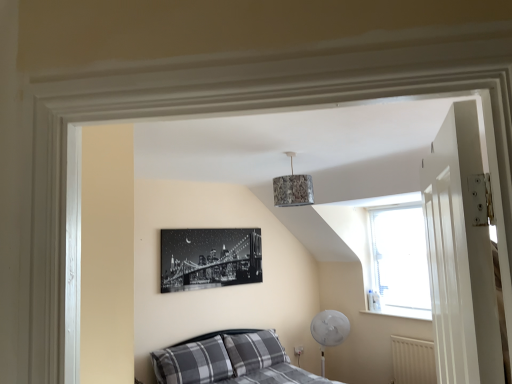
This screenshot has width=512, height=384. I want to click on textured fabric lampshade at upper center, so click(293, 188).

The width and height of the screenshot is (512, 384). What do you see at coordinates (210, 258) in the screenshot?
I see `black and white canvas print at center` at bounding box center [210, 258].

At what (x,y) coordinates should I click in order to perform the action: click on textured fabric lampshade at upper center. Please return your answer as a coordinate pair (x, y). Looking at the image, I should click on (293, 188).

From a real-world perspective, is plaid fabric bed at lower left beneath black and white canvas print at center?

Yes, from a real-world perspective, plaid fabric bed at lower left is beneath black and white canvas print at center.

Considering the sizes of objects plaid fabric bed at lower left and black and white canvas print at center in the image provided, who is smaller, plaid fabric bed at lower left or black and white canvas print at center?

Smaller between the two is black and white canvas print at center.

Find the location of a particular element. The width and height of the screenshot is (512, 384). bed on the right of black and white canvas print at center is located at coordinates (230, 361).

Considering the sizes of objects plaid fabric pillow at lower left, which is counted as the first pillow, starting from the left, and black and white canvas print at center in the image provided, who is wider, plaid fabric pillow at lower left, which is counted as the first pillow, starting from the left, or black and white canvas print at center?

plaid fabric pillow at lower left, which is counted as the first pillow, starting from the left, is wider.

Considering the relative positions of plaid fabric pillow at lower left, which is counted as the first pillow, starting from the left, and black and white canvas print at center in the image provided, is plaid fabric pillow at lower left, which is counted as the first pillow, starting from the left, to the left of black and white canvas print at center from the viewer's perspective?

Indeed, plaid fabric pillow at lower left, which is counted as the first pillow, starting from the left, is positioned on the left side of black and white canvas print at center.

Between plaid fabric pillow at lower left, positioned as the 2th pillow in right-to-left order, and black and white canvas print at center, which one has larger size?

plaid fabric pillow at lower left, positioned as the 2th pillow in right-to-left order, is bigger.

Does transparent glass window at upper right have a lesser height compared to white smooth window sill at lower right?

In fact, transparent glass window at upper right may be taller than white smooth window sill at lower right.

Which is correct: transparent glass window at upper right is inside white smooth window sill at lower right, or outside of it?

transparent glass window at upper right lies outside white smooth window sill at lower right.

Is transparent glass window at upper right smaller than white smooth window sill at lower right?

Incorrect, transparent glass window at upper right is not smaller in size than white smooth window sill at lower right.

From a real-world perspective, is transparent glass window at upper right positioned over white smooth window sill at lower right based on gravity?

Yes.

Where is `door that appears above the plaid fabric pillow at lower left, which is counted as the first pillow, starting from the left (from the image's perspective)`? door that appears above the plaid fabric pillow at lower left, which is counted as the first pillow, starting from the left (from the image's perspective) is located at coordinates (460, 255).

How far apart are white glossy door at right and plaid fabric pillow at lower left, positioned as the 2th pillow in right-to-left order?

A distance of 2.93 meters exists between white glossy door at right and plaid fabric pillow at lower left, positioned as the 2th pillow in right-to-left order.

Is white glossy door at right touching plaid fabric pillow at lower left, which is counted as the first pillow, starting from the left?

They are not placed beside each other.

Considering the positions of points (466, 177) and (198, 379), is point (466, 177) farther from camera compared to point (198, 379)?

That is False.

Between black and white canvas print at center and textured fabric lampshade at upper center, which one has smaller width?

With smaller width is black and white canvas print at center.

Is black and white canvas print at center positioned with its back to textured fabric lampshade at upper center?

black and white canvas print at center is not turned away from textured fabric lampshade at upper center.

From the image's perspective, is black and white canvas print at center on textured fabric lampshade at upper center?

No, from the image's perspective, black and white canvas print at center is not on top of textured fabric lampshade at upper center.

How distant is black and white canvas print at center from textured fabric lampshade at upper center?

They are 1.56 meters apart.

Considering the relative sizes of plaid fabric pillow at lower left, which is counted as the first pillow, starting from the left, and white glossy door at right in the image provided, is plaid fabric pillow at lower left, which is counted as the first pillow, starting from the left, smaller than white glossy door at right?

No.

Can you confirm if plaid fabric pillow at lower left, positioned as the 2th pillow in right-to-left order, is shorter than white glossy door at right?

Yes, plaid fabric pillow at lower left, positioned as the 2th pillow in right-to-left order, is shorter than white glossy door at right.

Relative to white glossy door at right, is plaid fabric pillow at lower left, which is counted as the first pillow, starting from the left, in front or behind?

In the image, plaid fabric pillow at lower left, which is counted as the first pillow, starting from the left, appears behind white glossy door at right.

Between point (160, 373) and point (469, 177), which one is positioned in front?

The point (469, 177) is closer.

How different are the orientations of white textured radiator at lower right and white smooth window sill at lower right in degrees?

There is a 0.546-degree angle between the facing directions of white textured radiator at lower right and white smooth window sill at lower right.

Who is shorter, white textured radiator at lower right or white smooth window sill at lower right?

Standing shorter between the two is white smooth window sill at lower right.

Where is `window sill above the white textured radiator at lower right (from the image's perspective)`? Image resolution: width=512 pixels, height=384 pixels. window sill above the white textured radiator at lower right (from the image's perspective) is located at coordinates (402, 313).

Is white textured radiator at lower right beside white smooth window sill at lower right?

No, white textured radiator at lower right is not with white smooth window sill at lower right.

The height and width of the screenshot is (384, 512). I want to click on bed in front of the black and white canvas print at center, so click(230, 361).

Locate an element on the screen. This screenshot has width=512, height=384. picture frame above the plaid fabric pillow at lower left, positioned as the 2th pillow in right-to-left order (from the image's perspective) is located at coordinates (210, 258).

When comparing their distances from white glossy door at right, does textured fabric lampshade at upper center or plaid fabric pillow at lower left, which is counted as the first pillow, starting from the left, seem closer?

Based on the image, textured fabric lampshade at upper center appears to be nearer to white glossy door at right.

Looking at the image, which one is located closer to white textured radiator at lower right, transparent glass window at upper right or plaid fabric pillow at lower left, which is counted as the first pillow, starting from the left?

Based on the image, transparent glass window at upper right appears to be nearer to white textured radiator at lower right.

From the image, which object appears to be farther from plaid fabric pillow at lower left, positioned as the 2th pillow in right-to-left order, plaid fabric bed at lower left or white glossy door at right?

Based on the image, white glossy door at right appears to be further to plaid fabric pillow at lower left, positioned as the 2th pillow in right-to-left order.

Looking at this image, based on their spatial positions, is gray plaid pillow at lower center, which is the second pillow in left-to-right order, or transparent glass window at upper right closer to plaid fabric bed at lower left?

gray plaid pillow at lower center, which is the second pillow in left-to-right order, lies closer to plaid fabric bed at lower left than the other object.

In the scene shown: Considering their positions, is white smooth window sill at lower right positioned further to black and white canvas print at center than textured fabric lampshade at upper center?

The object further to black and white canvas print at center is white smooth window sill at lower right.

Looking at the image, which one is located closer to plaid fabric pillow at lower left, positioned as the 2th pillow in right-to-left order, white smooth window sill at lower right or transparent glass window at upper right?

white smooth window sill at lower right.

Which object lies nearer to the anchor point plaid fabric pillow at lower left, positioned as the 2th pillow in right-to-left order, plaid fabric bed at lower left or white smooth window sill at lower right?

Among the two, plaid fabric bed at lower left is located nearer to plaid fabric pillow at lower left, positioned as the 2th pillow in right-to-left order.

Which object lies further to the anchor point white glossy door at right, textured fabric lampshade at upper center or black and white canvas print at center?

black and white canvas print at center.

Locate an element on the screen. window between textured fabric lampshade at upper center and white textured radiator at lower right in the up-down direction is located at coordinates (399, 261).

This screenshot has width=512, height=384. What are the coordinates of `window sill located between plaid fabric pillow at lower left, which is counted as the first pillow, starting from the left, and white textured radiator at lower right in the left-right direction` in the screenshot? It's located at (402, 313).

Image resolution: width=512 pixels, height=384 pixels. What are the coordinates of `bed between white glossy door at right and plaid fabric pillow at lower left, positioned as the 2th pillow in right-to-left order, along the z-axis` in the screenshot? It's located at (230, 361).

You are a GUI agent. You are given a task and a screenshot of the screen. Output one action in this format:
    pyautogui.click(x=<x>, y=<y>)
    Task: Click on the window sill between transparent glass window at upper right and white textured radiator at lower right from top to bottom
    This screenshot has height=384, width=512.
    Given the screenshot: What is the action you would take?
    pyautogui.click(x=402, y=313)